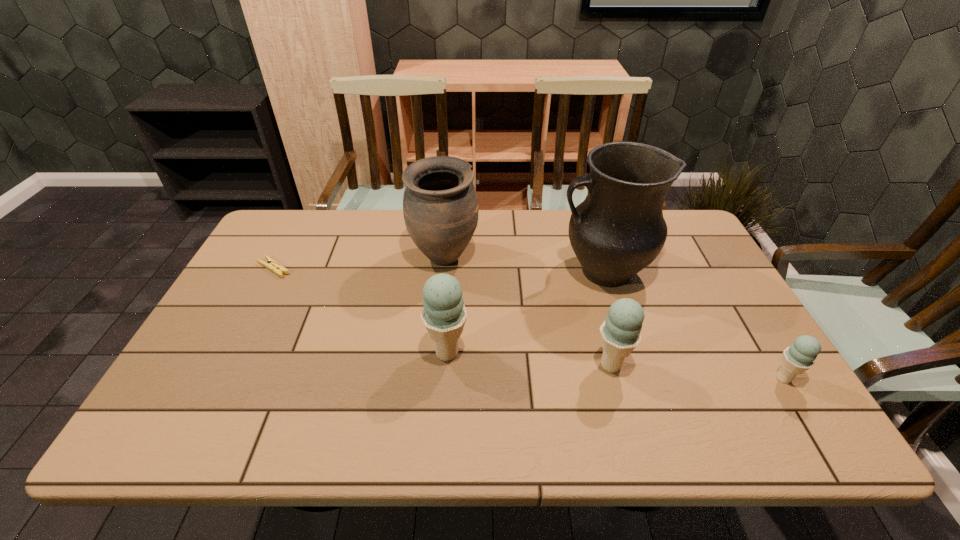
Please point out where to position a new ice cream on the left to maintain spacing. Please provide its 2D coordinates. Your answer should be formatted as a tuple, i.e. [(x, y)], where the tuple contains the x and y coordinates of a point satisfying the conditions above.

[(292, 340)]